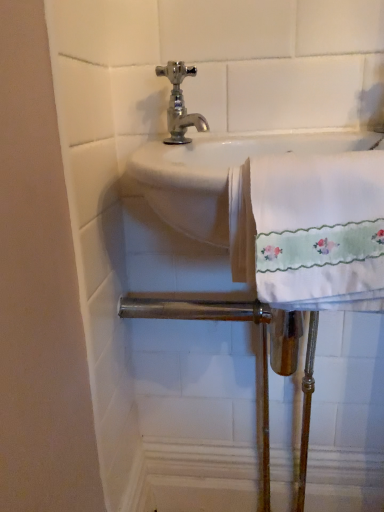
Question: Is white embroidered towel at right at the back of chrome/metallic faucet at upper center?

Choices:
 (A) no
 (B) yes

Answer: (A)

Question: From the image's perspective, is chrome/metallic faucet at upper center beneath white embroidered towel at right?

Choices:
 (A) no
 (B) yes

Answer: (A)

Question: From the image's perspective, is chrome/metallic faucet at upper center above white embroidered towel at right?

Choices:
 (A) no
 (B) yes

Answer: (B)

Question: Does chrome/metallic faucet at upper center have a greater height compared to white embroidered towel at right?

Choices:
 (A) no
 (B) yes

Answer: (A)

Question: Considering the relative positions of chrome/metallic faucet at upper center and white embroidered towel at right in the image provided, is chrome/metallic faucet at upper center to the left of white embroidered towel at right from the viewer's perspective?

Choices:
 (A) yes
 (B) no

Answer: (A)

Question: Considering the relative positions of chrome/metallic faucet at upper center and white embroidered towel at right in the image provided, is chrome/metallic faucet at upper center behind white embroidered towel at right?

Choices:
 (A) yes
 (B) no

Answer: (A)

Question: Is white embroidered towel at right to the right of chrome/metallic faucet at upper center from the viewer's perspective?

Choices:
 (A) no
 (B) yes

Answer: (B)

Question: Is white embroidered towel at right further to camera compared to chrome/metallic faucet at upper center?

Choices:
 (A) yes
 (B) no

Answer: (B)

Question: Can you confirm if white embroidered towel at right is shorter than chrome/metallic faucet at upper center?

Choices:
 (A) yes
 (B) no

Answer: (B)

Question: Is white embroidered towel at right thinner than chrome/metallic faucet at upper center?

Choices:
 (A) no
 (B) yes

Answer: (A)

Question: Is white embroidered towel at right oriented away from chrome/metallic faucet at upper center?

Choices:
 (A) no
 (B) yes

Answer: (A)

Question: Can chrome/metallic faucet at upper center be found inside white embroidered towel at right?

Choices:
 (A) no
 (B) yes

Answer: (A)

Question: From a real-world perspective, relative to white embroidered towel at right, is chrome/metallic faucet at upper center vertically above or below?

Choices:
 (A) above
 (B) below

Answer: (A)